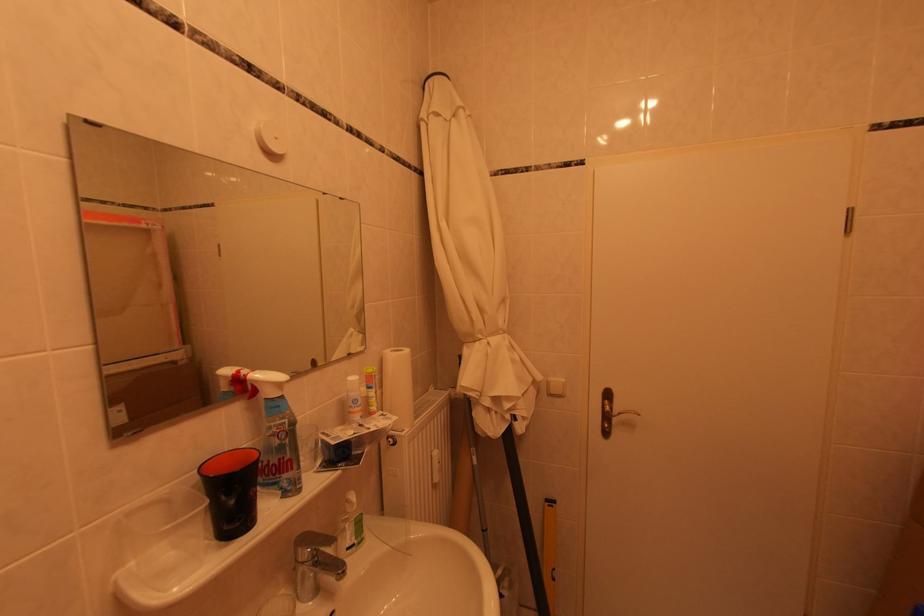
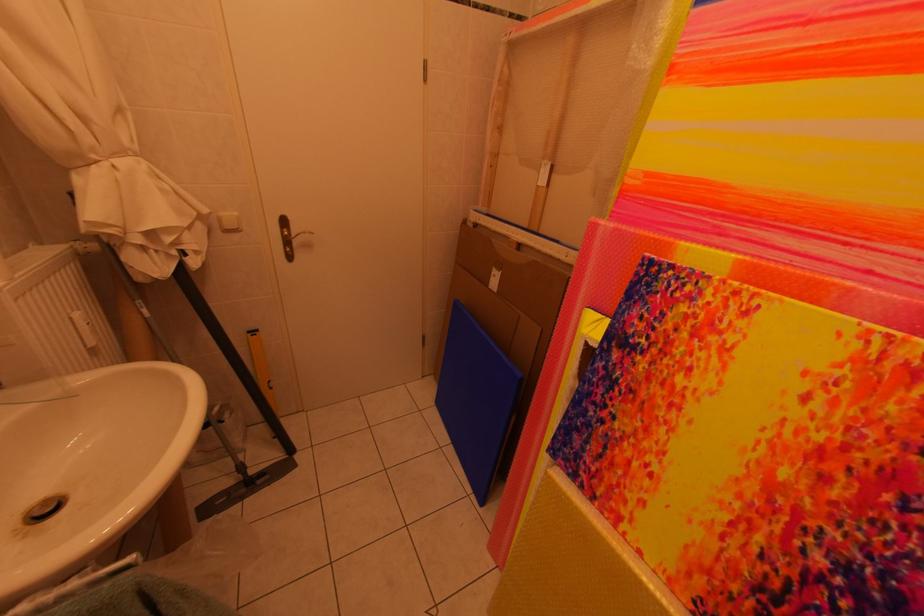
Find the pixel in the second image that matches (560,383) in the first image.

(229, 217)